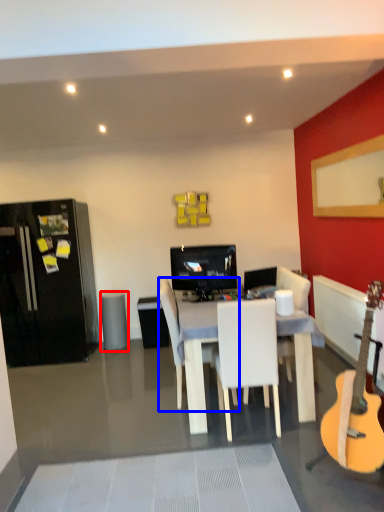
Question: Which object is closer to the camera taking this photo, trash bin/can (highlighted by a red box) or chair (highlighted by a blue box)?

Choices:
 (A) trash bin/can
 (B) chair

Answer: (B)